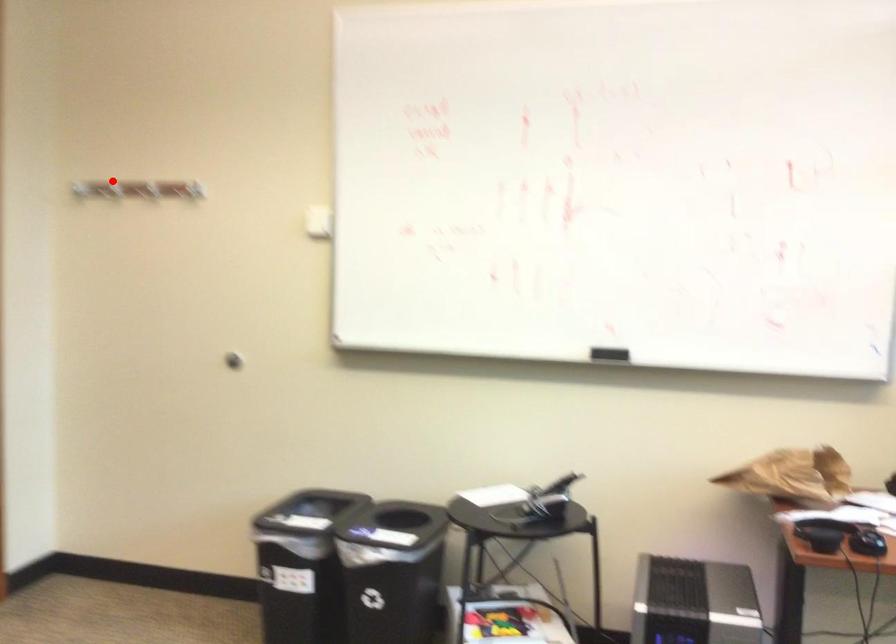
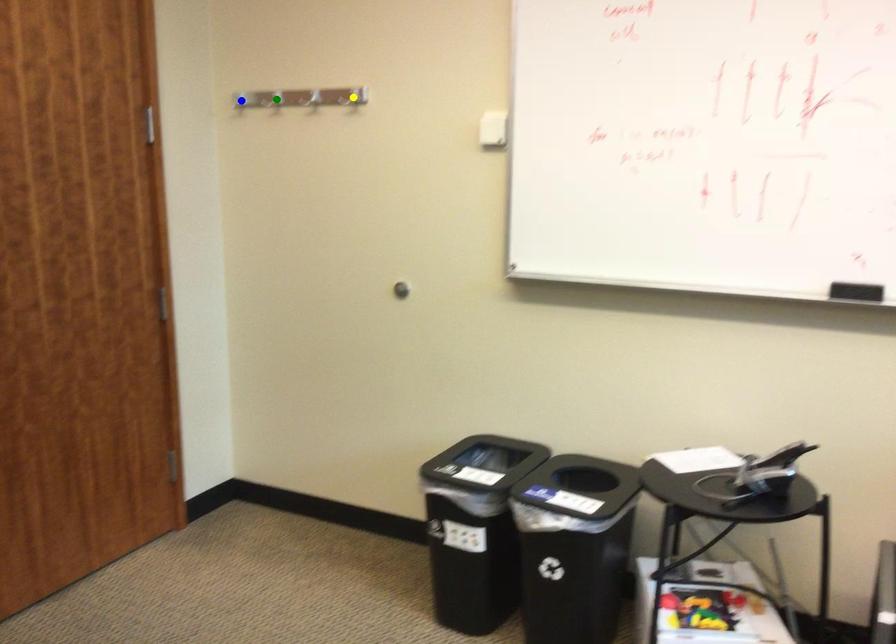
Question: I am providing you with two images of the same scene from different viewpoints. A red point is marked on the first image. You are given multiple points on the second image. In image 2, which mark is for the same physical point as the one in image 1?

Choices:
 (A) yellow point
 (B) blue point
 (C) green point

Answer: (C)